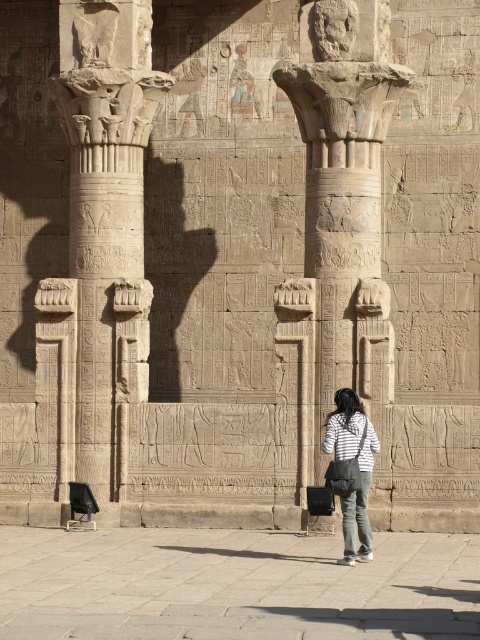
Looking at this image, is carved stone column at left wider than carved stone column at center?

In fact, carved stone column at left might be narrower than carved stone column at center.

Does carved stone column at left have a lesser height compared to carved stone column at center?

Indeed, carved stone column at left has a lesser height compared to carved stone column at center.

The width and height of the screenshot is (480, 640). I want to click on carved stone column at left, so click(x=106, y=221).

At what (x,y) coordinates should I click in order to perform the action: click on carved stone column at left. Please return your answer as a coordinate pair (x, y). The image size is (480, 640). Looking at the image, I should click on (106, 221).

Who is higher up, carved stone column at center or denim jeans at center?

Positioned higher is carved stone column at center.

Which is below, carved stone column at center or denim jeans at center?

denim jeans at center is below.

Where is `carved stone column at center`? The image size is (480, 640). carved stone column at center is located at coordinates (345, 196).

Where is `carved stone column at center`? The image size is (480, 640). carved stone column at center is located at coordinates (345, 196).

Can you confirm if carved stone column at left is smaller than denim jeans at center?

Indeed, carved stone column at left has a smaller size compared to denim jeans at center.

Does carved stone column at left have a lesser height compared to denim jeans at center?

No.

Is point (108, 442) positioned after point (345, 547)?

Yes, it is behind point (345, 547).

The image size is (480, 640). I want to click on carved stone column at left, so click(106, 221).